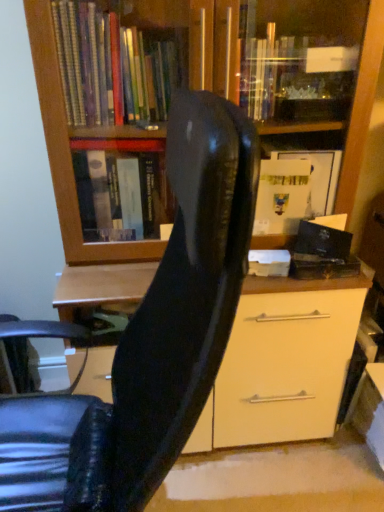
Question: Is matte wood bookcase at upper center taller or shorter than glossy black chair at center?

Choices:
 (A) short
 (B) tall

Answer: (B)

Question: Is point (66, 131) positioned closer to the camera than point (145, 492)?

Choices:
 (A) farther
 (B) closer

Answer: (A)

Question: Based on their relative distances, which object is farther from the matte wood bookcase at upper center?

Choices:
 (A) glossy black chair at center
 (B) black matte book at right

Answer: (A)

Question: Estimate the real-world distances between objects in this image. Which object is farther from the matte wood bookcase at upper center?

Choices:
 (A) black matte book at right
 (B) glossy black chair at center

Answer: (B)